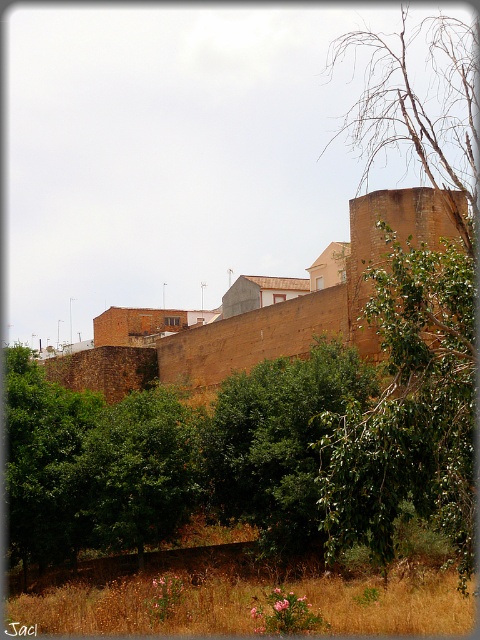
You are standing in the scene and want to find the largest green leafy tree. Which one should you look towards, the green leafy tree at right or the green leafy tree at center?

The green leafy tree at right is bigger than the green leafy tree at center, so you should look towards the green leafy tree at right.

You are standing in the scene and want to walk towards the two points marked in the image. Which point, point (444,364) or point (294,465), will you reach first?

Point (444,364) is closer to the camera than point (294,465), so you will reach point (444,364) first.